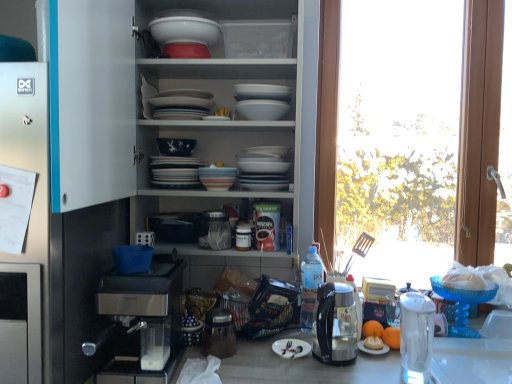
At what (x,y) coordinates should I click in order to perform the action: click on transparent glass electric kettle at center. Please return your answer as a coordinate pair (x, y). The height and width of the screenshot is (384, 512). Looking at the image, I should click on pos(335,324).

Where is `transparent glass window at right`? This screenshot has width=512, height=384. transparent glass window at right is located at coordinates (477, 127).

Image resolution: width=512 pixels, height=384 pixels. What do you see at coordinates (219, 334) in the screenshot?
I see `metallic silver canister at center, positioned as the third appliance in left-to-right order` at bounding box center [219, 334].

What do you see at coordinates (184, 32) in the screenshot? This screenshot has height=384, width=512. I see `white glossy bowl at upper center, which is the 1th appliance in left-to-right order` at bounding box center [184, 32].

Find the location of a particular element. This screenshot has height=384, width=512. transparent glass electric kettle at center is located at coordinates (335, 324).

From a real-world perspective, relative to translucent glass orange juice at lower right, is pastel striped bowl at center, which is the 1th tableware in left-to-right order, vertically above or below?

Clearly, from a real-world perspective, pastel striped bowl at center, which is the 1th tableware in left-to-right order, is above translucent glass orange juice at lower right.

Could you tell me if pastel striped bowl at center, the third tableware from the right, is turned towards translucent glass orange juice at lower right?

No, pastel striped bowl at center, the third tableware from the right, is not oriented towards translucent glass orange juice at lower right.

From the image's perspective, which one is positioned lower, pastel striped bowl at center, the 1th tableware from the top, or translucent glass orange juice at lower right?

translucent glass orange juice at lower right appears lower in the image.

Can you confirm if pastel striped bowl at center, the third tableware from the right, is thinner than translucent glass orange juice at lower right?

Incorrect, the width of pastel striped bowl at center, the third tableware from the right, is not less than that of translucent glass orange juice at lower right.

Is metallic silver canister at center, which ranks as the second appliance in right-to-left order, bigger or smaller than white glossy bowl at upper center, the fourth appliance positioned from the bottom?

metallic silver canister at center, which ranks as the second appliance in right-to-left order, is bigger than white glossy bowl at upper center, the fourth appliance positioned from the bottom.

Between metallic silver canister at center, the 4th appliance when ordered from top to bottom, and white glossy bowl at upper center, which is counted as the first appliance, starting from the top, which one has more height?

Standing taller between the two is metallic silver canister at center, the 4th appliance when ordered from top to bottom.

From the image's perspective, is metallic silver canister at center, which ranks as the second appliance in right-to-left order, beneath white glossy bowl at upper center, acting as the 4th appliance starting from the right?

Yes.

Is metallic silver canister at center, the 4th appliance when ordered from top to bottom, facing away from white glossy bowl at upper center, acting as the 4th appliance starting from the right?

No, metallic silver canister at center, the 4th appliance when ordered from top to bottom,'s orientation is not away from white glossy bowl at upper center, acting as the 4th appliance starting from the right.

Considering the positions of objects blue glass cake stand at right, arranged as the first tableware when viewed from the right, and transparent glass electric kettle at center in the image provided, who is behind, blue glass cake stand at right, arranged as the first tableware when viewed from the right, or transparent glass electric kettle at center?

blue glass cake stand at right, arranged as the first tableware when viewed from the right.

Does point (489, 299) come behind point (323, 292)?

Yes, it is behind point (323, 292).

Is blue glass cake stand at right, arranged as the first tableware when viewed from the right, turned away from transparent glass electric kettle at center?

No, blue glass cake stand at right, arranged as the first tableware when viewed from the right, is not facing the opposite direction of transparent glass electric kettle at center.

Measure the distance from pastel striped bowl at center, the 1th tableware from the top, to porcelain white bowl at center, the 2th bowl from the bottom.

6.43 inches.

Does pastel striped bowl at center, the third tableware from the right, turn towards porcelain white bowl at center, the 1th bowl viewed from the back?

No, pastel striped bowl at center, the third tableware from the right, does not turn towards porcelain white bowl at center, the 1th bowl viewed from the back.

Are pastel striped bowl at center, the 1th tableware from the top, and porcelain white bowl at center, the 2th bowl from the bottom, beside each other?

pastel striped bowl at center, the 1th tableware from the top, and porcelain white bowl at center, the 2th bowl from the bottom, are not in contact.

Can we say pastel striped bowl at center, the 1th tableware from the top, lies outside porcelain white bowl at center, the 1th bowl viewed from the back?

Absolutely, pastel striped bowl at center, the 1th tableware from the top, is external to porcelain white bowl at center, the 1th bowl viewed from the back.

From a real-world perspective, which is physically below, white glossy bowl at upper center, acting as the 4th appliance starting from the right, or white glossy plate at center, which ranks as the 2th tableware in right-to-left order?

white glossy plate at center, which ranks as the 2th tableware in right-to-left order.

Would you say white glossy plate at center, which is the first tableware from bottom to top, is part of white glossy bowl at upper center, which is the 1th appliance in left-to-right order,'s contents?

Definitely not — white glossy plate at center, which is the first tableware from bottom to top, is not inside white glossy bowl at upper center, which is the 1th appliance in left-to-right order.

Does white glossy bowl at upper center, acting as the 4th appliance starting from the right, come behind white glossy plate at center, the 3th tableware positioned from the top?

Yes, the depth of white glossy bowl at upper center, acting as the 4th appliance starting from the right, is greater than that of white glossy plate at center, the 3th tableware positioned from the top.

Considering the relative sizes of white glossy bowl at upper center, which is the 1th appliance in left-to-right order, and white glossy plate at center, the 2th tableware from the left, in the image provided, is white glossy bowl at upper center, which is the 1th appliance in left-to-right order, taller than white glossy plate at center, the 2th tableware from the left,?

Yes.

Consider the image. From a real-world perspective, is transparent glass water at right, acting as the 1th appliance starting from the right, over translucent glass orange juice at lower right?

Yes, from a real-world perspective, transparent glass water at right, acting as the 1th appliance starting from the right, is above translucent glass orange juice at lower right.

Considering the positions of points (406, 294) and (362, 331), is point (406, 294) closer to camera compared to point (362, 331)?

Yes, point (406, 294) is in front of point (362, 331).

From a real-world perspective, which appliance is the 2nd one above the translucent glass orange juice at lower right? Please provide its 2D coordinates.

[(416, 337)]

How different are the orientations of transparent glass water at right, the third appliance in the top-to-bottom sequence, and translucent glass orange juice at lower right in degrees?

The angular difference between transparent glass water at right, the third appliance in the top-to-bottom sequence, and translucent glass orange juice at lower right is 8.4 degrees.

Which object is wider, metallic silver canister at center, which ranks as the second appliance in right-to-left order, or blue woven basket at lower center, placed as the second bowl when sorted from top to bottom?

metallic silver canister at center, which ranks as the second appliance in right-to-left order, is wider.

Is metallic silver canister at center, the 4th appliance when ordered from top to bottom, completely or partially outside of blue woven basket at lower center, placed as the second bowl when sorted from top to bottom?

That's correct, metallic silver canister at center, the 4th appliance when ordered from top to bottom, is outside of blue woven basket at lower center, placed as the second bowl when sorted from top to bottom.

Consider the image. From a real-world perspective, who is located lower, metallic silver canister at center, positioned as the third appliance in left-to-right order, or blue woven basket at lower center, the second bowl positioned from the back?

From a 3D spatial view, metallic silver canister at center, positioned as the third appliance in left-to-right order, is below.

You are a GUI agent. You are given a task and a screenshot of the screen. Output one action in this format:
    pyautogui.click(x=<x>, y=<y>)
    Task: Click on the orange juice behind the pastel striped bowl at center, the 1th tableware from the top
    This screenshot has width=512, height=384.
    Given the screenshot: What is the action you would take?
    pyautogui.click(x=372, y=329)

You are a GUI agent. You are given a task and a screenshot of the screen. Output one action in this format:
    pyautogui.click(x=<x>, y=<y>)
    Task: Click on the appliance that is the 3rd one below the white glossy bowl at upper center, acting as the 4th appliance starting from the right (from a real-world perspective)
    
    Given the screenshot: What is the action you would take?
    pyautogui.click(x=219, y=334)

Considering their positions, is transparent glass window at right positioned further to white glossy plate at center, the 3th tableware positioned from the top, than white glossy bowl at upper center, acting as the 4th appliance starting from the right?

white glossy bowl at upper center, acting as the 4th appliance starting from the right, is further to white glossy plate at center, the 3th tableware positioned from the top.

Estimate the real-world distances between objects in this image. Which object is closer to metallic silver canister at center, which ranks as the second appliance in right-to-left order, transparent glass water at right, acting as the 1th appliance starting from the right, or transparent glass jar at center, the 2th appliance viewed from the left?

transparent glass jar at center, the 2th appliance viewed from the left, lies closer to metallic silver canister at center, which ranks as the second appliance in right-to-left order, than the other object.

Which object lies further to the anchor point metallic silver canister at center, the 1th appliance positioned from the bottom, blue glass cake stand at right, which is counted as the second tableware, starting from the top, or metallic silver coffee maker at lower left?

The object further to metallic silver canister at center, the 1th appliance positioned from the bottom, is blue glass cake stand at right, which is counted as the second tableware, starting from the top.

Which object lies nearer to the anchor point clear plastic bottle at center, transparent glass window at right or silver plated fork at center?

silver plated fork at center lies closer to clear plastic bottle at center than the other object.

Which object lies nearer to the anchor point metallic silver canister at center, the 1th appliance positioned from the bottom, transparent glass electric kettle at center or metallic silver coffee maker at lower left?

metallic silver coffee maker at lower left lies closer to metallic silver canister at center, the 1th appliance positioned from the bottom, than the other object.

Which object lies further to the anchor point transparent glass window at right, porcelain white bowl at center, the 1th bowl viewed from the back, or orange matte at right?

orange matte at right is positioned further to the anchor transparent glass window at right.

Looking at the image, which one is located further to blue woven basket at lower center, the first bowl from the front, porcelain white bowl at center, the 1th bowl viewed from the back, or white glossy bowls at upper center?

Among the two, white glossy bowls at upper center is located further to blue woven basket at lower center, the first bowl from the front.

Considering their positions, is silver plated fork at center positioned closer to transparent glass window at right than white glossy plate at center, which is the first tableware from bottom to top?

white glossy plate at center, which is the first tableware from bottom to top.

Image resolution: width=512 pixels, height=384 pixels. In order to click on orange juice between blue fabric basket at left and transparent glass window at right from left to right in this screenshot , I will do `click(372, 329)`.

The width and height of the screenshot is (512, 384). What are the coordinates of `kitchen appliance located between metallic silver canister at center, which ranks as the second appliance in right-to-left order, and blue glass cake stand at right, which is the second tableware in bottom-to-top order, in the left-right direction` in the screenshot? It's located at (335, 324).

At what (x,y) coordinates should I click in order to perform the action: click on silverware located between blue woven basket at lower center, the second bowl positioned from the back, and blue glass cake stand at right, which is the second tableware in bottom-to-top order, in the left-right direction. Please return your answer as a coordinate pair (x, y). Looking at the image, I should click on (287, 347).

You are a GUI agent. You are given a task and a screenshot of the screen. Output one action in this format:
    pyautogui.click(x=<x>, y=<y>)
    Task: Click on the shelf between blue fabric basket at left and white glossy plate at center, the 3th tableware positioned from the top
    
    Given the screenshot: What is the action you would take?
    pyautogui.click(x=233, y=109)